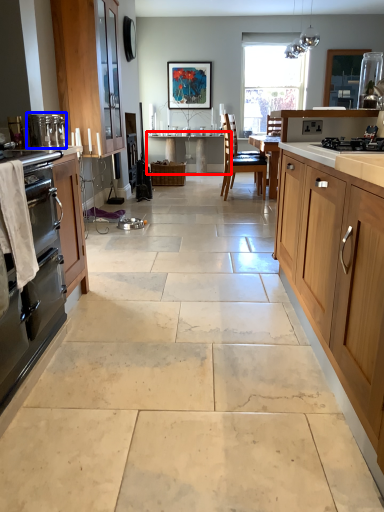
Question: Which point is closer to the camera, table (highlighted by a red box) or appliance (highlighted by a blue box)?

Choices:
 (A) table
 (B) appliance

Answer: (B)